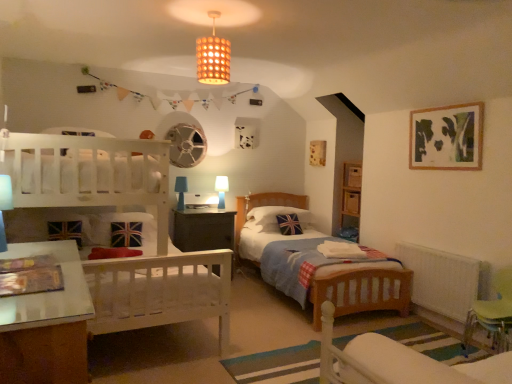
This screenshot has width=512, height=384. In order to click on free region under wooden lampshade at upper center (from a real-world perspective) in this screenshot , I will do `click(206, 366)`.